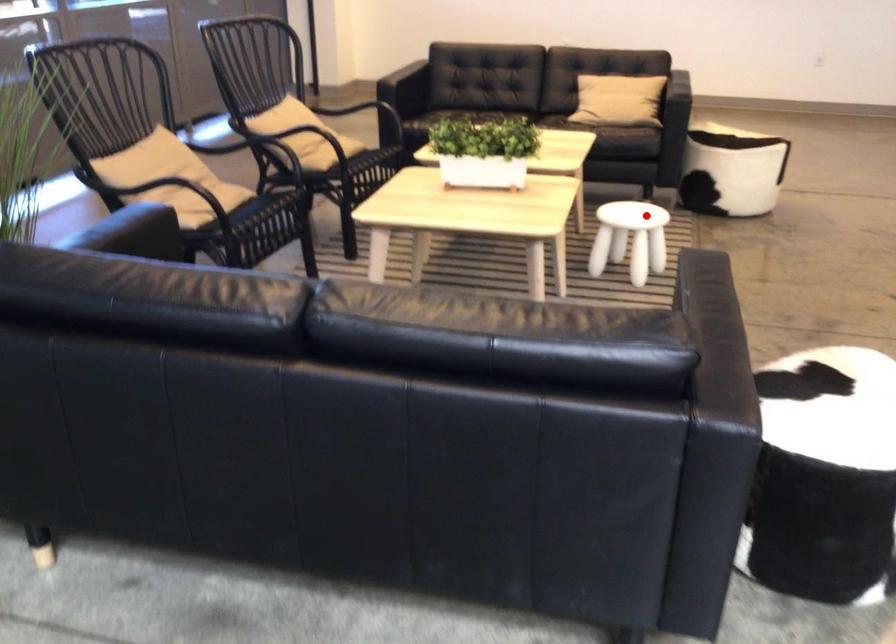
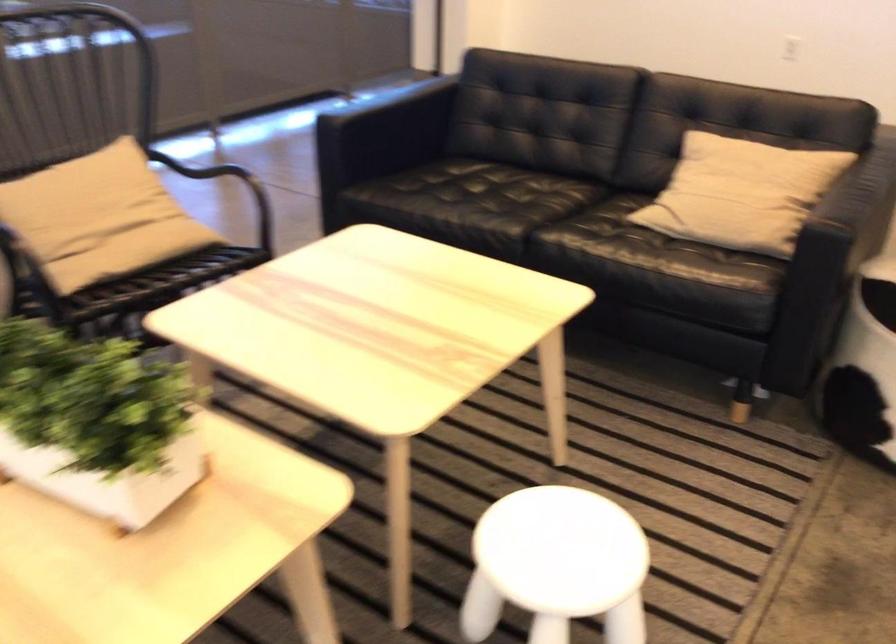
The point at the highlighted location is marked in the first image. Where is the corresponding point in the second image?

(556, 565)